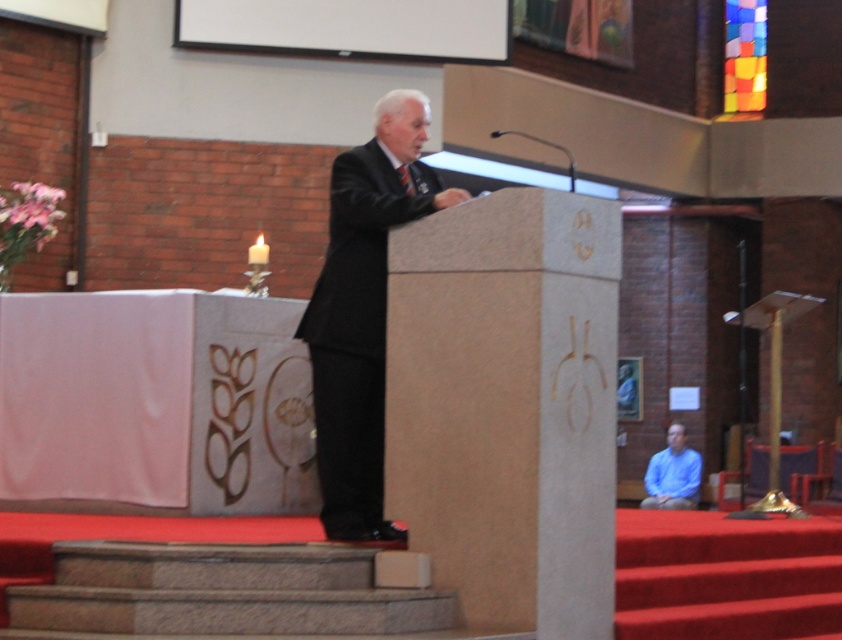
Question: Which object is farther from the camera taking this photo?

Choices:
 (A) blue matte shirt at lower right
 (B) dark suit at center

Answer: (A)

Question: Can you confirm if dark suit at center is smaller than blue matte shirt at lower right?

Choices:
 (A) yes
 (B) no

Answer: (B)

Question: Can you confirm if dark suit at center is positioned below blue matte shirt at lower right?

Choices:
 (A) no
 (B) yes

Answer: (A)

Question: Can you confirm if dark suit at center is positioned to the left of blue matte shirt at lower right?

Choices:
 (A) yes
 (B) no

Answer: (A)

Question: Which of the following is the farthest from the observer?

Choices:
 (A) (681, 465)
 (B) (393, 152)

Answer: (A)

Question: Which point is closer to the camera?

Choices:
 (A) dark suit at center
 (B) blue matte shirt at lower right

Answer: (A)